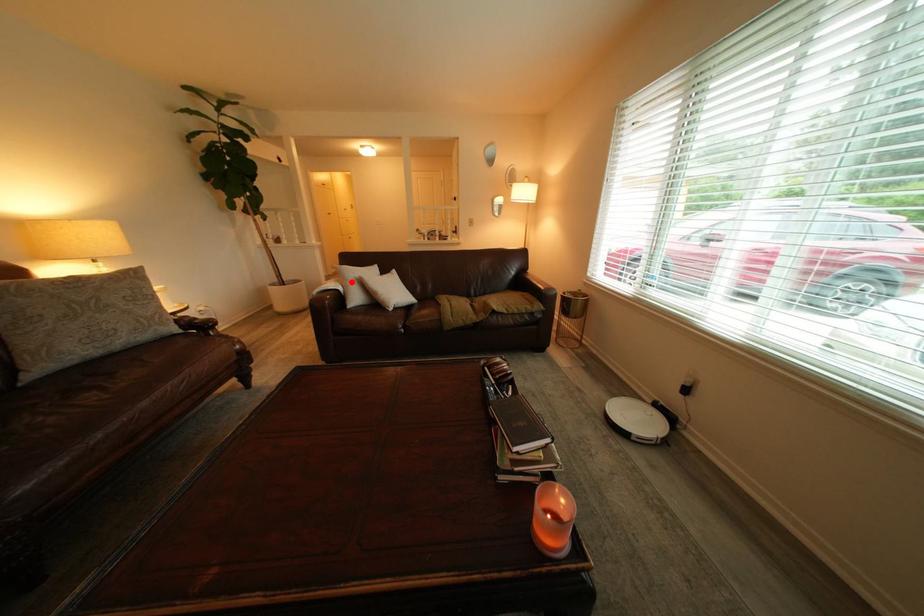
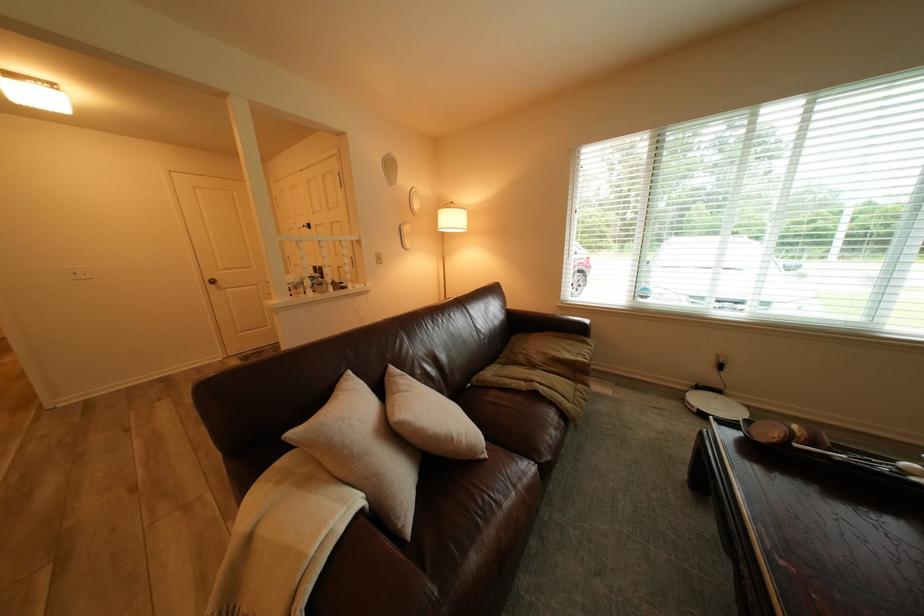
Locate, in the second image, the point that corresponds to the highlighted location in the first image.

(320, 483)